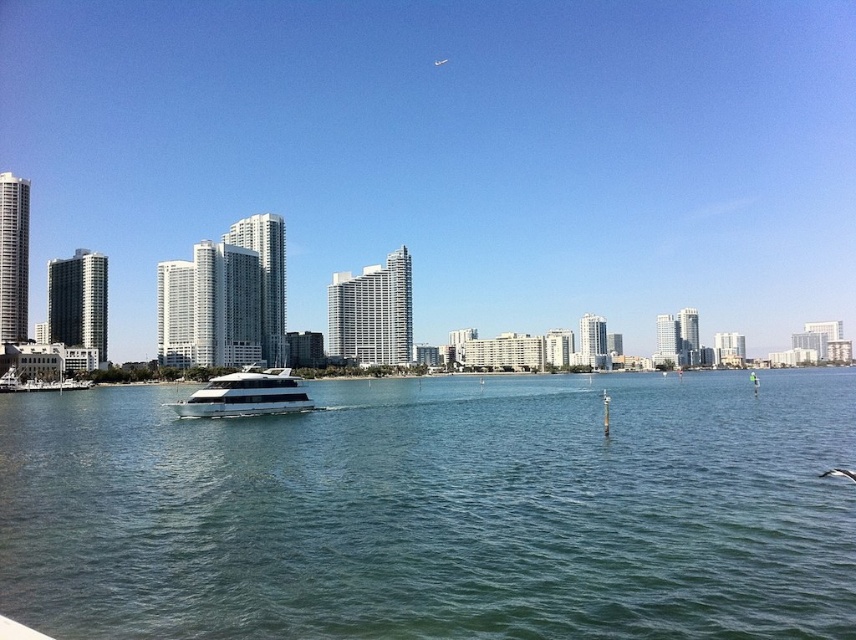
Does point (306, 500) come farther from viewer compared to point (200, 404)?

No, (306, 500) is closer to viewer.

Can you confirm if greenish-blue water at center is taller than white glossy boat at center?

No.

Is point (837, 570) closer to viewer compared to point (224, 387)?

Yes, point (837, 570) is in front of point (224, 387).

Where is `greenish-blue water at center`? greenish-blue water at center is located at coordinates (438, 512).